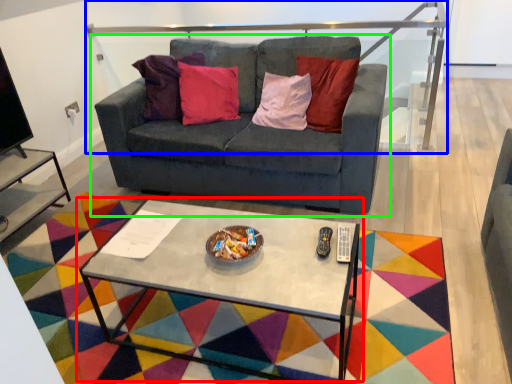
Question: Which object is the farthest from coffee table (highlighted by a red box)? Choose among these: balustrade (highlighted by a blue box) or studio couch (highlighted by a green box).

Choices:
 (A) balustrade
 (B) studio couch

Answer: (A)